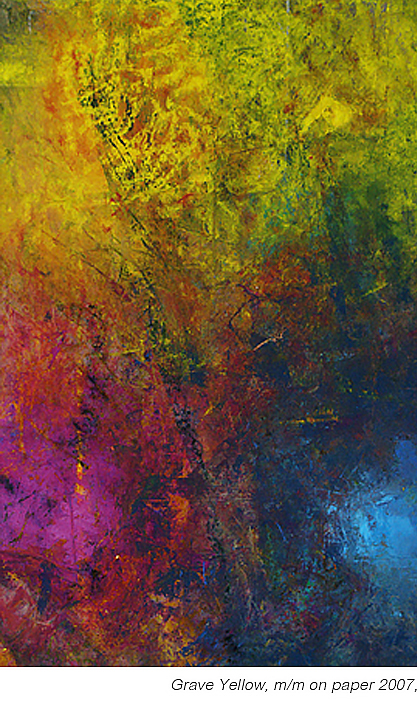
Locate an element on the screen. The width and height of the screenshot is (417, 708). blue part of painting is located at coordinates (361, 409), (290, 539), (341, 622).